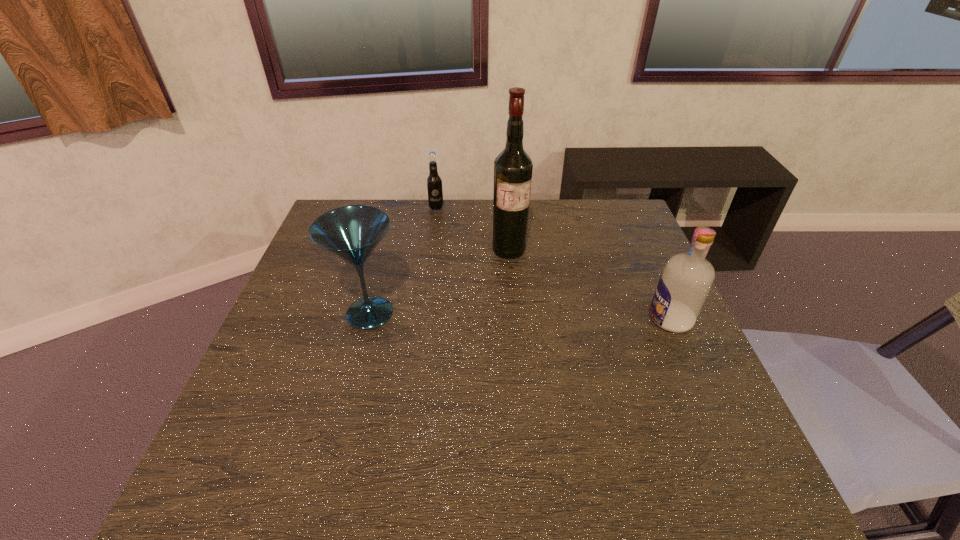
This screenshot has width=960, height=540. What are the coordinates of `martini` in the screenshot? It's located at (351, 233).

In order to click on vodka in this screenshot , I will do `click(686, 280)`.

Locate an element on the screen. The width and height of the screenshot is (960, 540). the tallest object is located at coordinates (513, 167).

The height and width of the screenshot is (540, 960). Identify the location of wine bottle. (513, 167).

Where is `the shortest object`? The width and height of the screenshot is (960, 540). the shortest object is located at coordinates (434, 182).

Find the location of a particular element. This screenshot has width=960, height=540. root beer is located at coordinates (434, 182).

You are a GUI agent. You are given a task and a screenshot of the screen. Output one action in this format:
    pyautogui.click(x=<x>, y=<y>)
    Task: Click on the vacant space situated 0.120m on the front of the leftmost object
    The height and width of the screenshot is (540, 960).
    Given the screenshot: What is the action you would take?
    pyautogui.click(x=352, y=381)

You are a GUI agent. You are given a task and a screenshot of the screen. Output one action in this format:
    pyautogui.click(x=<x>, y=<y>)
    Task: Click on the blank area located on the label of the vodka
    The image size is (960, 540).
    Given the screenshot: What is the action you would take?
    pyautogui.click(x=584, y=319)

The image size is (960, 540). I want to click on blank space located on the label of the vodka, so click(x=609, y=319).

The height and width of the screenshot is (540, 960). I want to click on free space located on the label of the vodka, so click(507, 319).